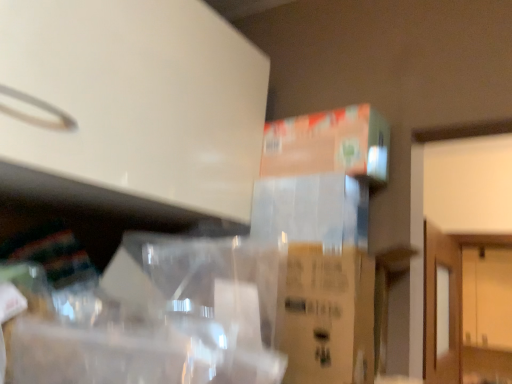
Question: From the image's perspective, is wooden cabinet at right located above or below orange cardboard box at upper right?

Choices:
 (A) above
 (B) below

Answer: (B)

Question: Considering the positions of point (501, 314) and point (313, 142), is point (501, 314) closer or farther from the camera than point (313, 142)?

Choices:
 (A) farther
 (B) closer

Answer: (A)

Question: From a real-world perspective, is wooden cabinet at right positioned above or below orange cardboard box at upper right?

Choices:
 (A) above
 (B) below

Answer: (B)

Question: Considering the positions of orange cardboard box at upper right and wooden cabinet at right in the image, is orange cardboard box at upper right taller or shorter than wooden cabinet at right?

Choices:
 (A) tall
 (B) short

Answer: (B)

Question: Considering their positions, is orange cardboard box at upper right located in front of or behind wooden cabinet at right?

Choices:
 (A) behind
 (B) front

Answer: (B)

Question: Considering the positions of orange cardboard box at upper right and wooden cabinet at right in the image, is orange cardboard box at upper right wider or thinner than wooden cabinet at right?

Choices:
 (A) thin
 (B) wide

Answer: (A)

Question: Is orange cardboard box at upper right spatially inside wooden cabinet at right, or outside of it?

Choices:
 (A) inside
 (B) outside

Answer: (B)